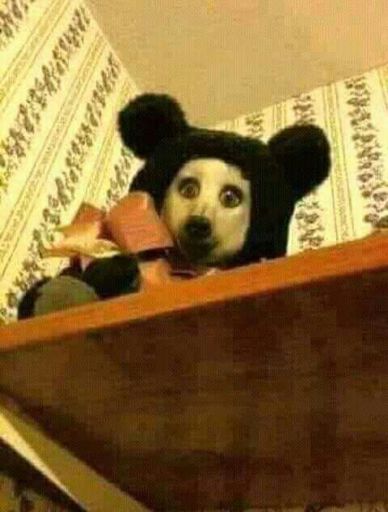
Where is `ceiling`? ceiling is located at coordinates (244, 91).